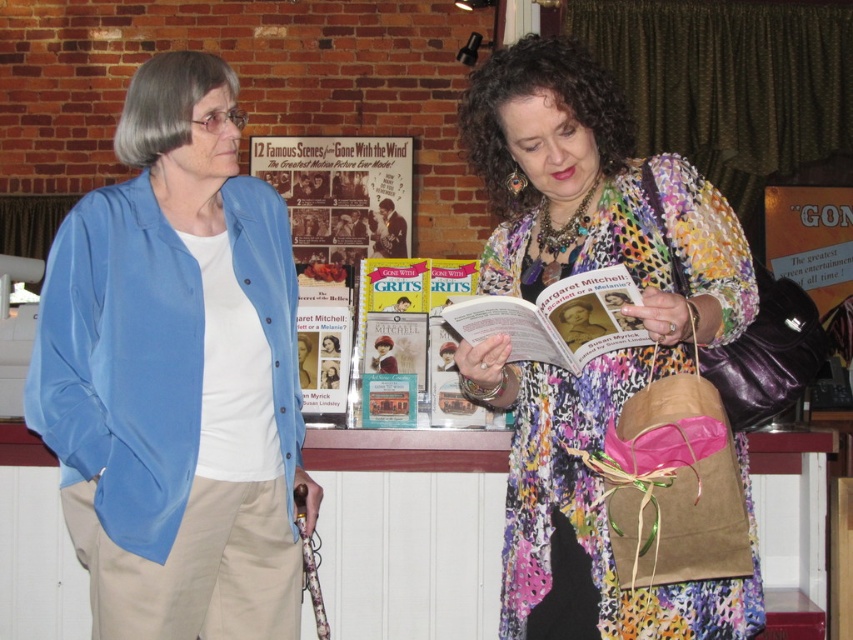
Question: Which of the following is the closest to the observer?

Choices:
 (A) (480, 161)
 (B) (483, 308)
 (C) (364, 241)

Answer: (B)

Question: Based on their relative distances, which object is farther from the matte paper book at center?

Choices:
 (A) hardcover book at center
 (B) floral silk dress at center

Answer: (B)

Question: Which object is the closest to the matte blue shirt at left?

Choices:
 (A) matte paper poster at center
 (B) matte paper book at center
 (C) matte paper magazine at center

Answer: (C)

Question: Is hardcover book at center behind matte paper magazine at center?

Choices:
 (A) yes
 (B) no

Answer: (A)

Question: Does matte paper poster at center appear under matte paper book at center?

Choices:
 (A) yes
 (B) no

Answer: (B)

Question: Can you confirm if matte blue shirt at left is thinner than floral silk dress at center?

Choices:
 (A) no
 (B) yes

Answer: (B)